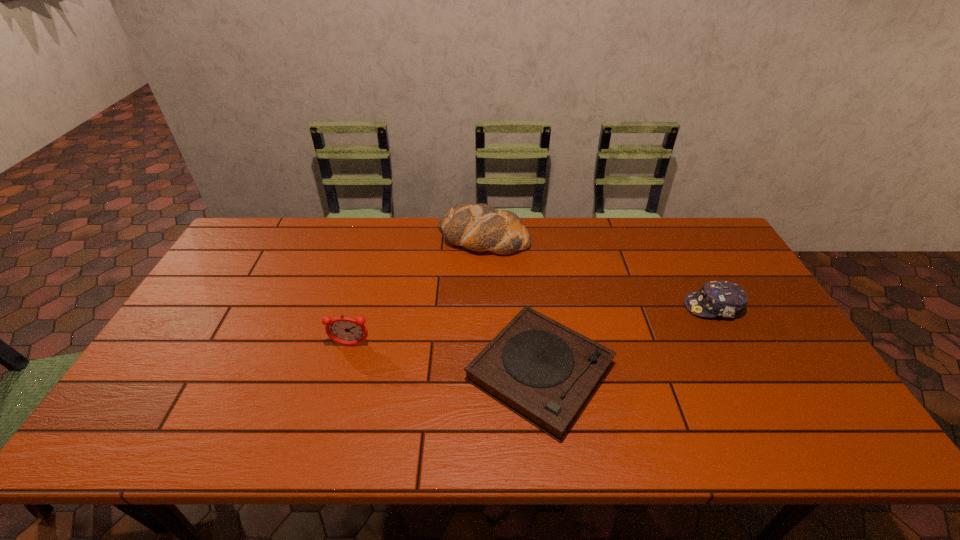
Where is `free point located on the back of the shortest object`? The width and height of the screenshot is (960, 540). free point located on the back of the shortest object is located at coordinates (525, 253).

What are the coordinates of `object located in the far edge section of the desktop` in the screenshot? It's located at (480, 227).

Where is `object that is at the near edge`? The image size is (960, 540). object that is at the near edge is located at coordinates (543, 371).

At what (x,y) coordinates should I click in order to perform the action: click on object present at the right edge. Please return your answer as a coordinate pair (x, y). Looking at the image, I should click on (725, 299).

Identify the location of vacant space at the far edge. The image size is (960, 540). (336, 250).

The image size is (960, 540). I want to click on vacant position at the near edge of the desktop, so click(x=183, y=436).

The width and height of the screenshot is (960, 540). I want to click on vacant space at the far right corner of the desktop, so click(x=676, y=229).

At what (x,y) coordinates should I click in order to perform the action: click on free spot at the near right corner of the desktop. Please return your answer as a coordinate pair (x, y). The height and width of the screenshot is (540, 960). Looking at the image, I should click on (823, 423).

Locate an element on the screen. vacant area between the bread and the rightmost object is located at coordinates (598, 273).

At what (x,y) coordinates should I click in order to perform the action: click on unoccupied position between the headwear and the bread. Please return your answer as a coordinate pair (x, y). This screenshot has height=540, width=960. Looking at the image, I should click on (598, 273).